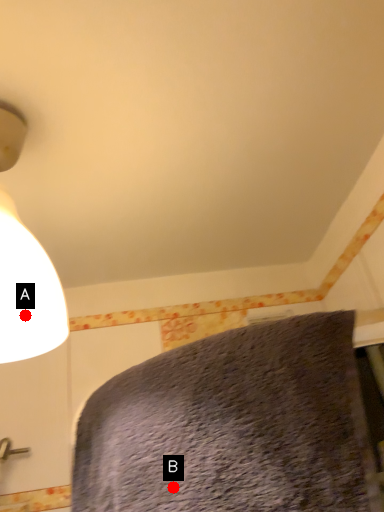
Question: Two points are circled on the image, labeled by A and B beside each circle. Which of the following is the closest to the observer?

Choices:
 (A) A is closer
 (B) B is closer

Answer: (B)